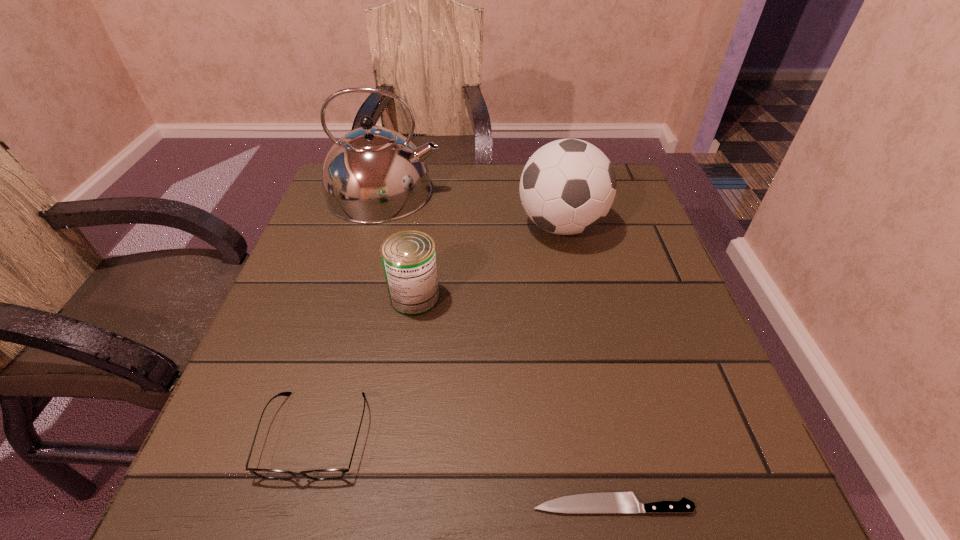
The image size is (960, 540). In order to click on object that is the third closest to the third shortest object in this screenshot , I will do `click(372, 175)`.

The width and height of the screenshot is (960, 540). I want to click on object that is the fourth closest to the fourth farthest object, so click(372, 175).

Where is `vacant space that satisfies the following two spatial constraints: 1. from the spout of the tallest object; 2. on the back side of the soccer ball`? The height and width of the screenshot is (540, 960). vacant space that satisfies the following two spatial constraints: 1. from the spout of the tallest object; 2. on the back side of the soccer ball is located at coordinates (375, 226).

You are a GUI agent. You are given a task and a screenshot of the screen. Output one action in this format:
    pyautogui.click(x=<x>, y=<y>)
    Task: Click on the free point that satisfies the following two spatial constraints: 1. on the back side of the third nearest object; 2. on the right side of the fourth shortest object
    
    Given the screenshot: What is the action you would take?
    pyautogui.click(x=425, y=226)

In order to click on vacant space that satisfies the following two spatial constraints: 1. from the spout of the shortest object; 2. on the left side of the kettle in this screenshot , I will do `click(298, 504)`.

Locate an element on the screen. free spot that satisfies the following two spatial constraints: 1. from the spout of the tallest object; 2. on the right side of the second tallest object is located at coordinates (375, 226).

This screenshot has width=960, height=540. Find the location of `free spot that satisfies the following two spatial constraints: 1. on the back side of the second tallest object; 2. from the spout of the kettle`. free spot that satisfies the following two spatial constraints: 1. on the back side of the second tallest object; 2. from the spout of the kettle is located at coordinates (554, 193).

In order to click on vacant region that satisfies the following two spatial constraints: 1. from the spout of the tallest object; 2. on the left side of the second tallest object in this screenshot , I will do point(375,226).

Where is `free spot that satisfies the following two spatial constraints: 1. from the spout of the tallest object; 2. on the right side of the can`? This screenshot has height=540, width=960. free spot that satisfies the following two spatial constraints: 1. from the spout of the tallest object; 2. on the right side of the can is located at coordinates (355, 298).